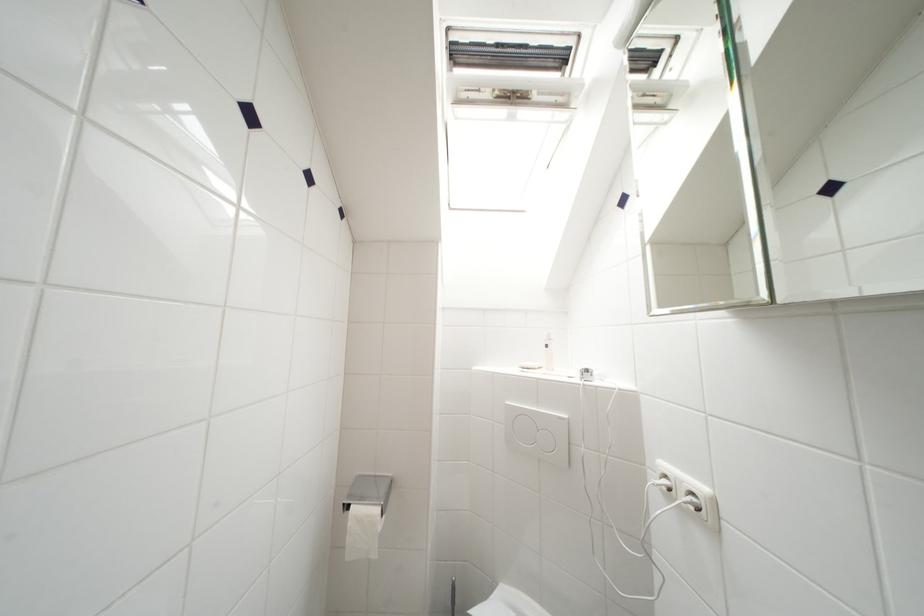
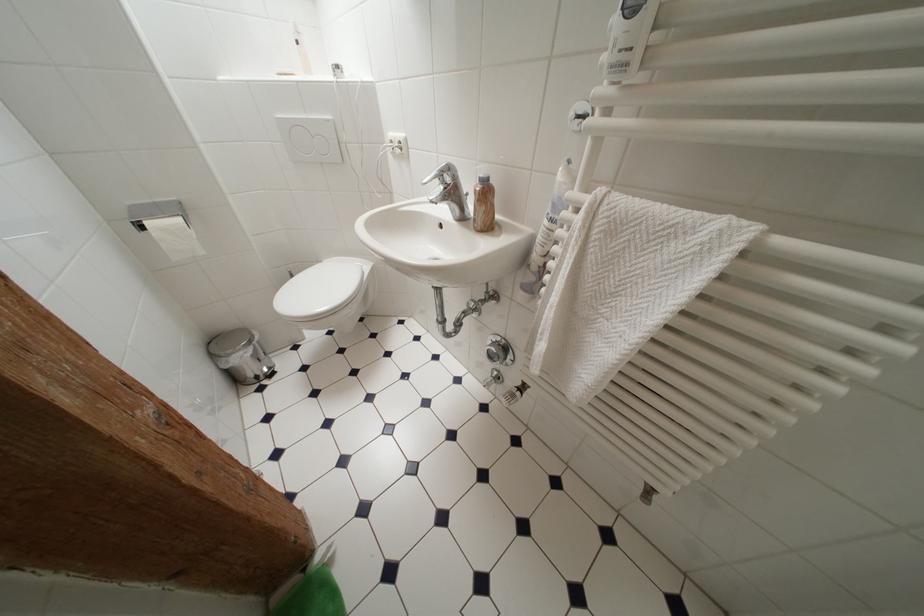
In the second image, find the point that corresponds to the point at 565,421 in the first image.

(333, 124)